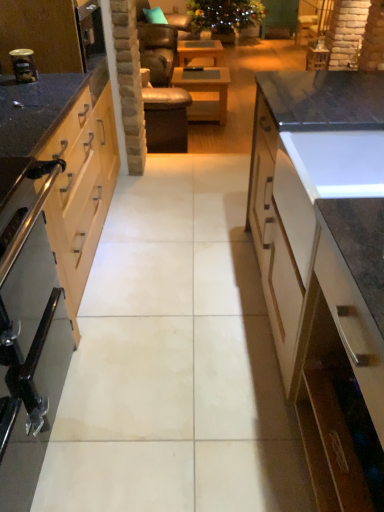
Question: Does metallic silver canister at left have a lesser width compared to wooden at center, the first table when ordered from bottom to top?

Choices:
 (A) no
 (B) yes

Answer: (B)

Question: From a real-world perspective, is metallic silver canister at left under wooden at center, which appears as the 2th table when viewed from the back?

Choices:
 (A) no
 (B) yes

Answer: (A)

Question: Can you confirm if metallic silver canister at left is smaller than wooden at center, the first table from the front?

Choices:
 (A) yes
 (B) no

Answer: (A)

Question: From the image's perspective, is metallic silver canister at left below wooden at center, which appears as the 2th table when viewed from the top?

Choices:
 (A) no
 (B) yes

Answer: (B)

Question: Considering the relative sizes of metallic silver canister at left and wooden at center, the first table when ordered from bottom to top, in the image provided, is metallic silver canister at left taller than wooden at center, the first table when ordered from bottom to top,?

Choices:
 (A) yes
 (B) no

Answer: (B)

Question: Are metallic silver canister at left and wooden at center, which appears as the 2th table when viewed from the top, located far from each other?

Choices:
 (A) no
 (B) yes

Answer: (B)

Question: Considering the relative sizes of teal fabric pillow at upper center and metallic silver canister at left in the image provided, is teal fabric pillow at upper center smaller than metallic silver canister at left?

Choices:
 (A) no
 (B) yes

Answer: (A)

Question: Is teal fabric pillow at upper center looking in the opposite direction of metallic silver canister at left?

Choices:
 (A) no
 (B) yes

Answer: (A)

Question: Does teal fabric pillow at upper center have a greater height compared to metallic silver canister at left?

Choices:
 (A) no
 (B) yes

Answer: (B)

Question: Is teal fabric pillow at upper center not near metallic silver canister at left?

Choices:
 (A) no
 (B) yes

Answer: (B)

Question: Considering the relative sizes of teal fabric pillow at upper center and metallic silver canister at left in the image provided, is teal fabric pillow at upper center wider than metallic silver canister at left?

Choices:
 (A) yes
 (B) no

Answer: (A)

Question: Can you confirm if teal fabric pillow at upper center is positioned to the right of metallic silver canister at left?

Choices:
 (A) yes
 (B) no

Answer: (A)

Question: Can you confirm if wooden table at center, the 2th table viewed from the front, is bigger than stainless steel oven at left?

Choices:
 (A) no
 (B) yes

Answer: (A)